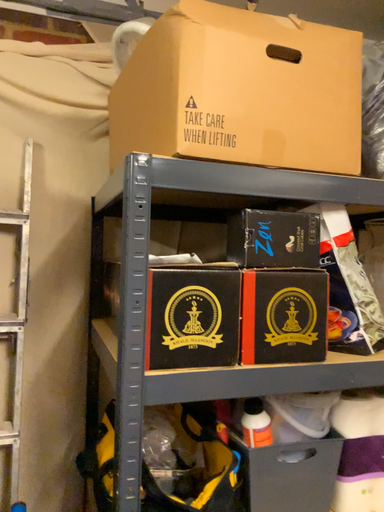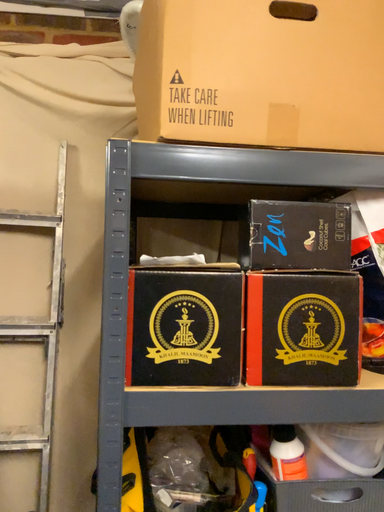
Question: Which way did the camera rotate in the video?

Choices:
 (A) rotated left
 (B) rotated right

Answer: (A)